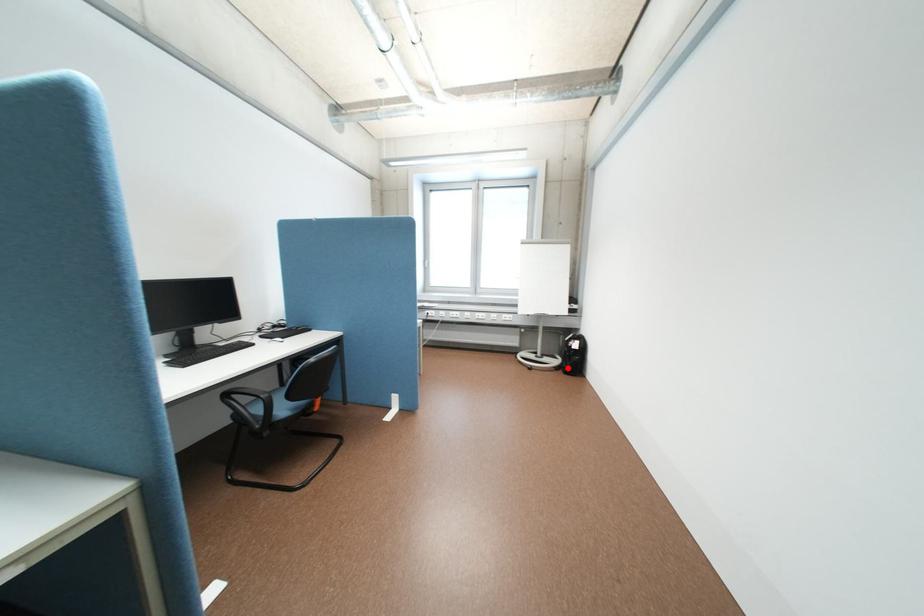
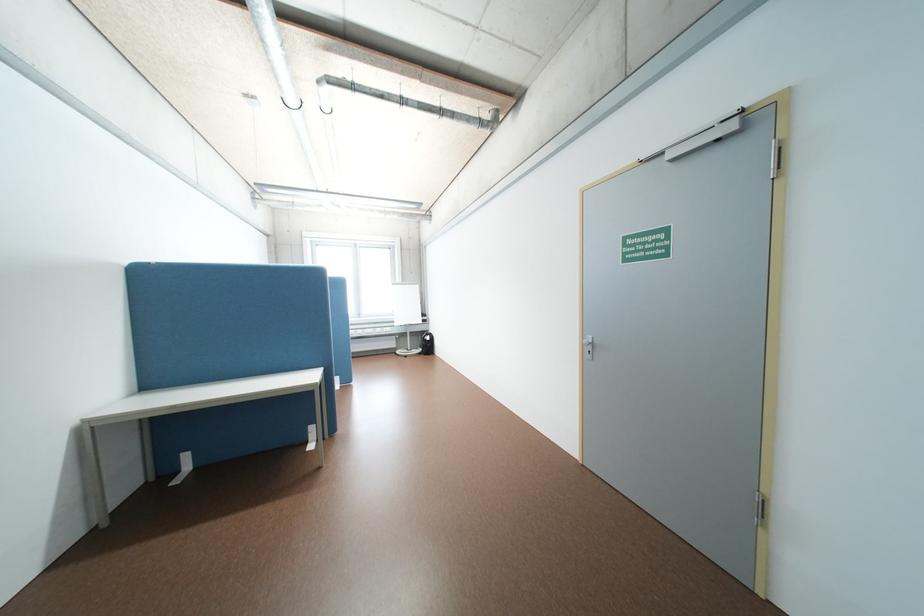
Question: I am providing you with two images of the same scene from different viewpoints. A red point is shown in image1. For the corresponding object point in image2, is it positioned nearer or farther from the camera?

Choices:
 (A) Nearer
 (B) Farther

Answer: (B)